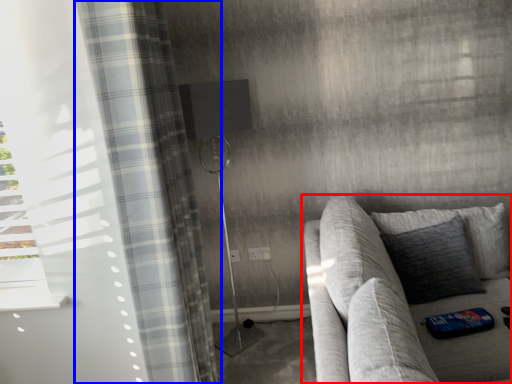
Question: Which of the following is the closest to the observer, studio couch (highlighted by a red box) or curtain (highlighted by a blue box)?

Choices:
 (A) studio couch
 (B) curtain

Answer: (A)